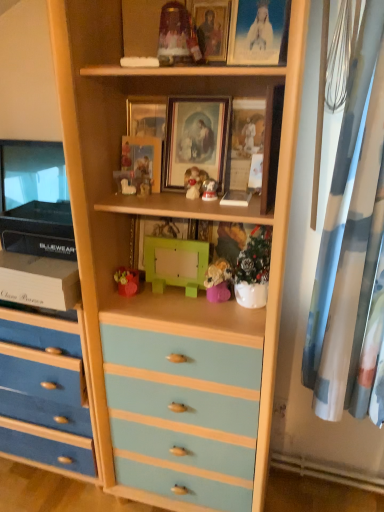
Question: Considering the relative positions of matte porcelain figurine at center, arranged as the 4th toy when ordered from the bottom, and purple matte toy at center, marked as the second toy in a bottom-to-top arrangement, in the image provided, is matte porcelain figurine at center, arranged as the 4th toy when ordered from the bottom, to the right of purple matte toy at center, marked as the second toy in a bottom-to-top arrangement, from the viewer's perspective?

Choices:
 (A) yes
 (B) no

Answer: (B)

Question: Is purple matte toy at center, which is counted as the 1th toy, starting from the right, located within matte porcelain figurine at center, marked as the 2th toy in a top-to-bottom arrangement?

Choices:
 (A) yes
 (B) no

Answer: (B)

Question: From a real-world perspective, is matte porcelain figurine at center, marked as the 2th toy in a top-to-bottom arrangement, under purple matte toy at center, acting as the 5th toy starting from the left?

Choices:
 (A) yes
 (B) no

Answer: (B)

Question: From the image's perspective, is matte porcelain figurine at center, the 3th toy viewed from the left, over purple matte toy at center, acting as the 5th toy starting from the left?

Choices:
 (A) no
 (B) yes

Answer: (B)

Question: Can you confirm if matte porcelain figurine at center, marked as the 2th toy in a top-to-bottom arrangement, is smaller than purple matte toy at center, acting as the 5th toy starting from the left?

Choices:
 (A) no
 (B) yes

Answer: (B)

Question: From a real-world perspective, is matte porcelain figurine at center, the 3th toy viewed from the left, on top of purple matte toy at center, which is counted as the 1th toy, starting from the right?

Choices:
 (A) no
 (B) yes

Answer: (B)

Question: Does matte red plush toy at center, the 5th toy viewed from the right, touch matte glass jar at upper center, which is the fifth toy in bottom-to-top order?

Choices:
 (A) yes
 (B) no

Answer: (B)

Question: Are matte red plush toy at center, the first toy when ordered from bottom to top, and matte glass jar at upper center, which is the fifth toy in bottom-to-top order, far apart?

Choices:
 (A) yes
 (B) no

Answer: (B)

Question: Is the depth of matte red plush toy at center, arranged as the 5th toy when viewed from the top, less than that of matte glass jar at upper center, which is the fifth toy in bottom-to-top order?

Choices:
 (A) yes
 (B) no

Answer: (B)

Question: Is matte red plush toy at center, the first toy when ordered from bottom to top, thinner than matte glass jar at upper center, which is counted as the fourth toy, starting from the right?

Choices:
 (A) no
 (B) yes

Answer: (B)

Question: Does matte red plush toy at center, marked as the first toy in a left-to-right arrangement, lie behind matte glass jar at upper center, the 2th toy when ordered from left to right?

Choices:
 (A) no
 (B) yes

Answer: (B)

Question: Considering the relative sizes of matte red plush toy at center, the 5th toy viewed from the right, and matte glass jar at upper center, which is the fifth toy in bottom-to-top order, in the image provided, is matte red plush toy at center, the 5th toy viewed from the right, shorter than matte glass jar at upper center, which is the fifth toy in bottom-to-top order,?

Choices:
 (A) yes
 (B) no

Answer: (A)

Question: Is matte glass jar at upper center, arranged as the first toy when viewed from the top, turned away from matte gold picture frame at upper center, the 1th picture frame in the right-to-left sequence?

Choices:
 (A) yes
 (B) no

Answer: (B)